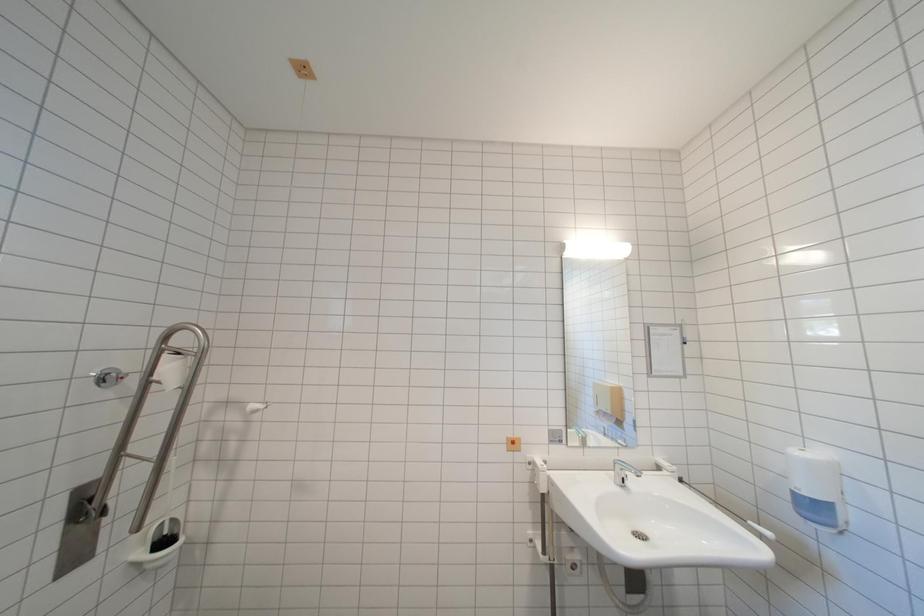
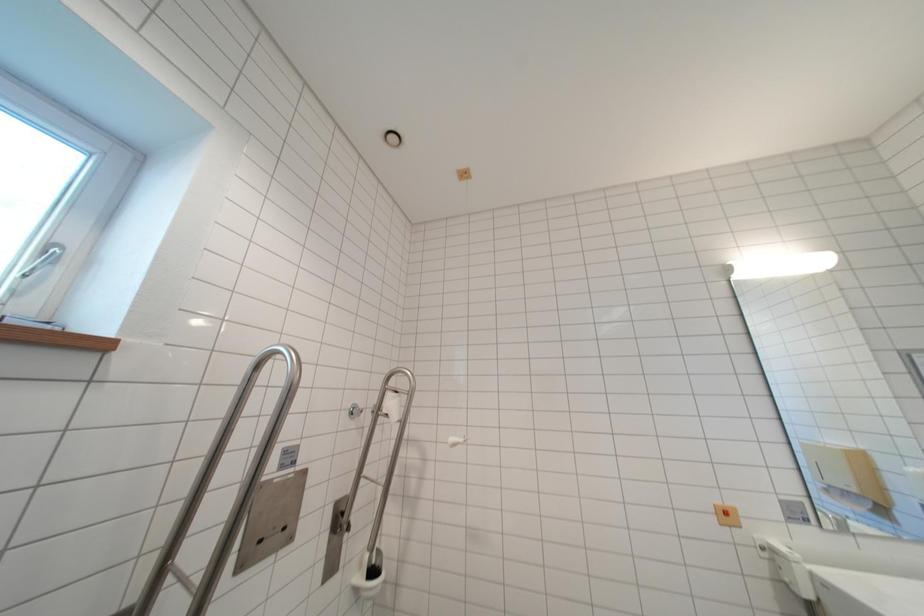
Question: The camera is either moving clockwise (left) or counter-clockwise (right) around the object. The first image is from the beginning of the video and the second image is from the end. Is the camera moving left or right when shooting the video?

Choices:
 (A) Left
 (B) Right

Answer: (B)